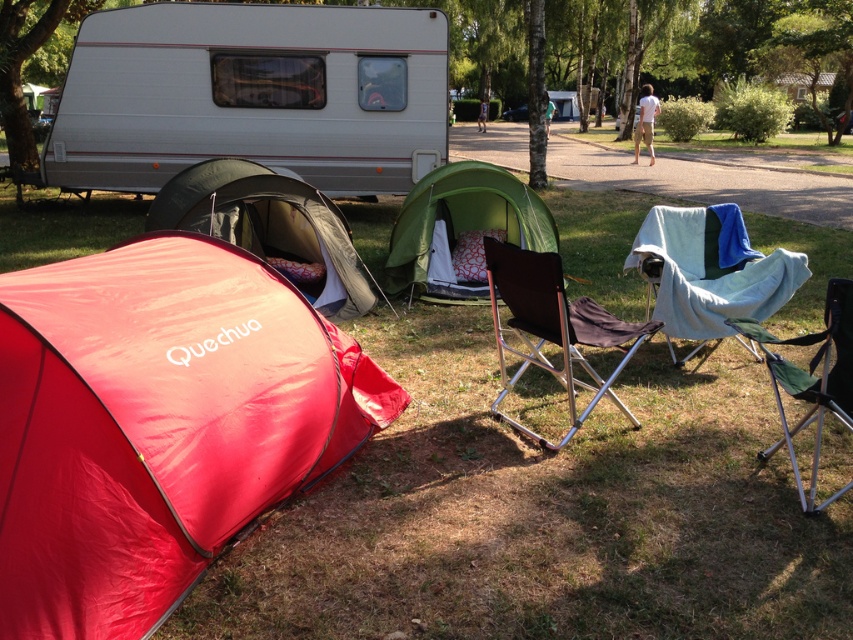
You are planning to set up a tent in the camping area shown. You have a green fabric tent at center and a green fabric person at center. Which object is smaller in size?

The green fabric tent at center is smaller in size compared to the green fabric person at center.

You are setting up a picnic area and need to place a picnic basket between the white glossy caravan at upper left and the blue fabric chair at center right. Based on their positions, where should you place the basket to ensure it is between them?

The white glossy caravan at upper left is to the left of the blue fabric chair at center right, so you should place the picnic basket to the right of the white glossy caravan at upper left and to the left of the blue fabric chair at center right to position it between them.